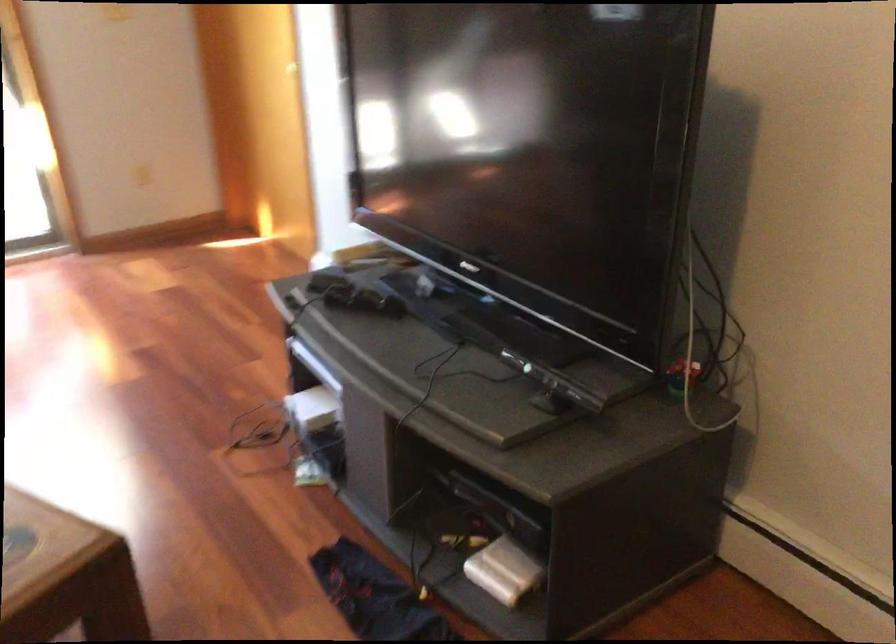
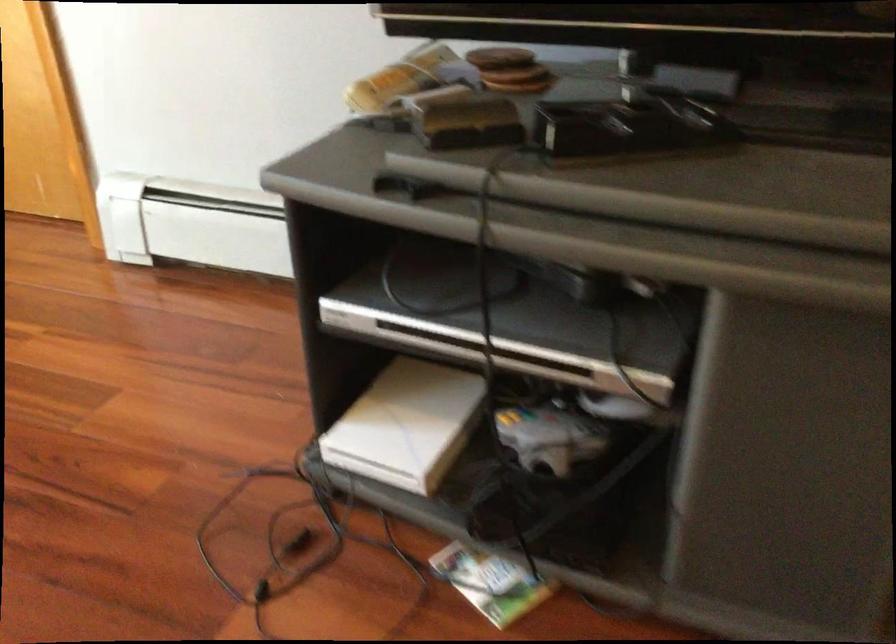
Locate, in the second image, the point that corresponds to pixel 401 257 in the first image.

(519, 80)